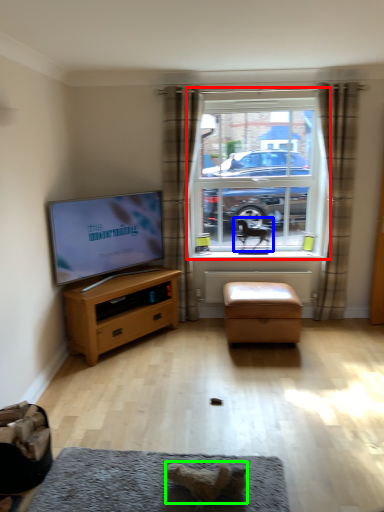
Question: Which object is the farthest from window (highlighted by a red box)? Choose among these: animal (highlighted by a blue box) or animal (highlighted by a green box).

Choices:
 (A) animal
 (B) animal

Answer: (B)